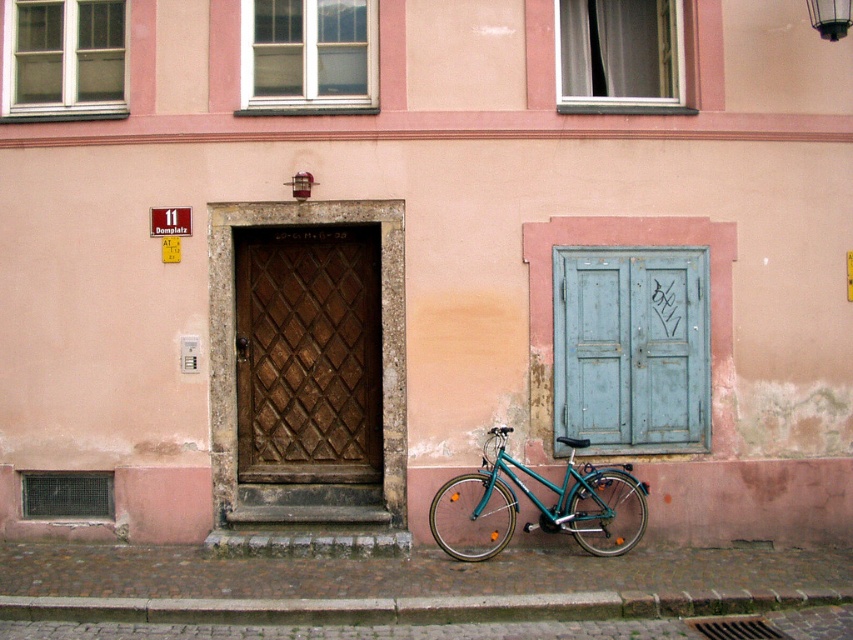
You are a delivery person trying to park your teal metallic bicycle at lower center near the entrance. The green painted wood window at upper left is above an entrance door. Is your bicycle currently parked under the window above the door?

Yes, the teal metallic bicycle at lower center is positioned under the green painted wood window at upper left, which is above an entrance door, so the bicycle is parked under the window above the door.